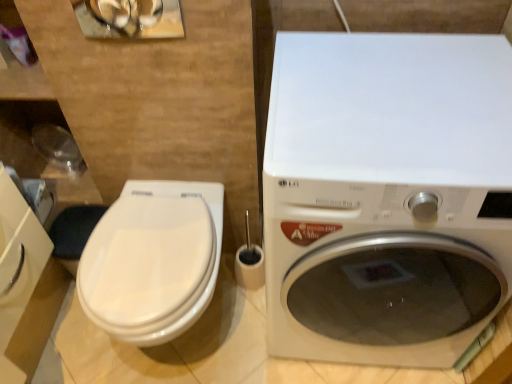
In order to face white glossy washing machine at right, should I rotate leftwards or rightwards?

Rotate right and turn 15.504 degrees.

The height and width of the screenshot is (384, 512). Describe the element at coordinates (387, 195) in the screenshot. I see `white glossy washing machine at right` at that location.

Find the location of a particular element. white glossy washing machine at right is located at coordinates (387, 195).

This screenshot has height=384, width=512. Describe the element at coordinates (153, 260) in the screenshot. I see `white glossy toilet at left` at that location.

Where is `white glossy toilet at left`? Image resolution: width=512 pixels, height=384 pixels. white glossy toilet at left is located at coordinates (153, 260).

The width and height of the screenshot is (512, 384). In order to click on white glossy washing machine at right in this screenshot , I will do coord(387,195).

Considering the relative positions of white glossy washing machine at right and white glossy toilet at left in the image provided, is white glossy washing machine at right to the left or to the right of white glossy toilet at left?

From the image, it's evident that white glossy washing machine at right is to the right of white glossy toilet at left.

Considering their positions, is white glossy washing machine at right located in front of or behind white glossy toilet at left?

In the image, white glossy washing machine at right appears in front of white glossy toilet at left.

Which is more distant, (365, 356) or (164, 305)?

Point (365, 356)

From the image's perspective, is white glossy washing machine at right above white glossy toilet at left?

Yes, from the image's perspective, white glossy washing machine at right is over white glossy toilet at left.

From a real-world perspective, does white glossy washing machine at right sit lower than white glossy toilet at left?

No, from a real-world perspective, white glossy washing machine at right is not under white glossy toilet at left.

Does white glossy washing machine at right have a greater width compared to white glossy toilet at left?

Yes.

Can you confirm if white glossy washing machine at right is taller than white glossy toilet at left?

Yes, white glossy washing machine at right is taller than white glossy toilet at left.

Considering the relative sizes of white glossy washing machine at right and white glossy toilet at left in the image provided, is white glossy washing machine at right smaller than white glossy toilet at left?

No, white glossy washing machine at right is not smaller than white glossy toilet at left.

Is white glossy washing machine at right not within white glossy toilet at left?

Yes, white glossy washing machine at right is outside of white glossy toilet at left.

Is white glossy washing machine at right beside white glossy toilet at left?

There is a gap between white glossy washing machine at right and white glossy toilet at left.

Is white glossy washing machine at right turned away from white glossy toilet at left?

No, white glossy washing machine at right is not facing away from white glossy toilet at left.

Identify the location of washing machine positioned vertically above the white glossy toilet at left (from a real-world perspective). This screenshot has height=384, width=512. (387, 195).

Based on the photo, between white glossy toilet at left and white glossy washing machine at right, which one appears on the right side from the viewer's perspective?

From the viewer's perspective, white glossy washing machine at right appears more on the right side.

Considering their positions, is white glossy toilet at left located in front of or behind white glossy washing machine at right?

Visually, white glossy toilet at left is located behind white glossy washing machine at right.

Does point (213, 188) come in front of point (506, 69)?

No.

From the image's perspective, between white glossy toilet at left and white glossy washing machine at right, which one is located above?

From the image's view, white glossy washing machine at right is above.

From a real-world perspective, is white glossy toilet at left physically above white glossy washing machine at right?

No, from a real-world perspective, white glossy toilet at left is not over white glossy washing machine at right

Can you confirm if white glossy toilet at left is thinner than white glossy washing machine at right?

Indeed, white glossy toilet at left has a lesser width compared to white glossy washing machine at right.

Between white glossy toilet at left and white glossy washing machine at right, which one has less height?

white glossy toilet at left is shorter.

Consider the image. Between white glossy toilet at left and white glossy washing machine at right, which one has smaller size?

white glossy toilet at left is smaller.

Would you say white glossy washing machine at right is part of white glossy toilet at left's contents?

No, white glossy toilet at left does not contain white glossy washing machine at right.

Does white glossy toilet at left touch white glossy washing machine at right?

They are not placed beside each other.

Is white glossy toilet at left oriented towards white glossy washing machine at right?

No, white glossy toilet at left is not turned towards white glossy washing machine at right.

Locate an element on the screen. The height and width of the screenshot is (384, 512). washing machine above the white glossy toilet at left (from the image's perspective) is located at coordinates (387, 195).

Where is `toilet directly beneath the white glossy washing machine at right (from a real-world perspective)`? toilet directly beneath the white glossy washing machine at right (from a real-world perspective) is located at coordinates (153, 260).

I want to click on toilet lying behind the white glossy washing machine at right, so click(x=153, y=260).